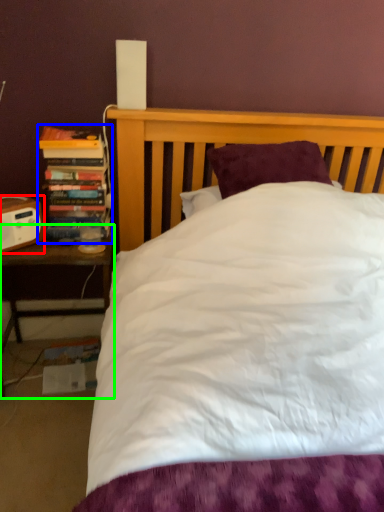
Question: Based on their relative distances, which object is farther from speaker (highlighted by a red box)? Choose from book (highlighted by a blue box) and nightstand (highlighted by a green box).

Choices:
 (A) book
 (B) nightstand

Answer: (B)